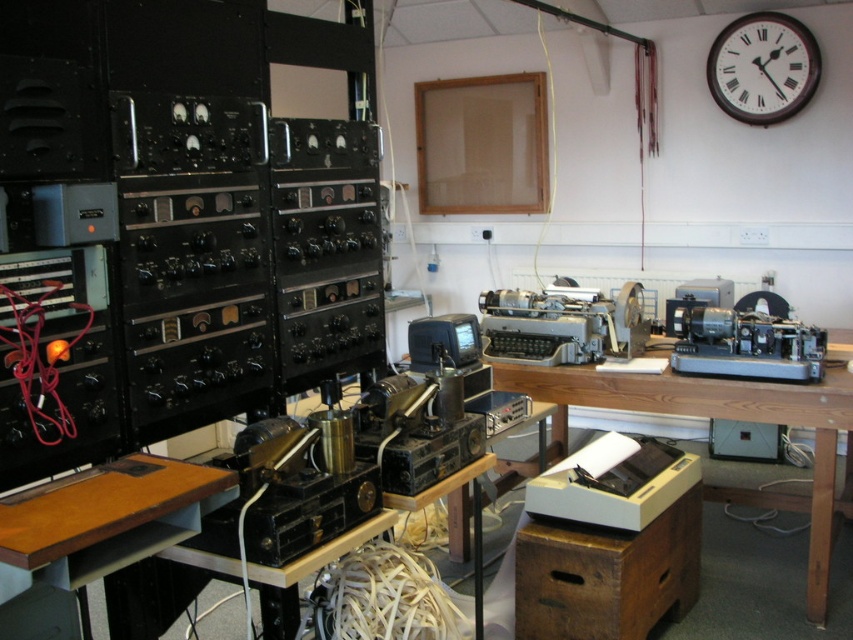
Question: Which object appears farthest from the camera in this image?

Choices:
 (A) metallic gray typewriter at center
 (B) wooden table at center
 (C) brown wooden clock at upper right

Answer: (C)

Question: Is wooden table at center to the left of brown wooden clock at upper right from the viewer's perspective?

Choices:
 (A) yes
 (B) no

Answer: (A)

Question: Which point appears farthest from the camera in this image?

Choices:
 (A) (576, 337)
 (B) (776, 99)

Answer: (B)

Question: Considering the relative positions of wooden table at center and metallic gray typewriter at center in the image provided, where is wooden table at center located with respect to metallic gray typewriter at center?

Choices:
 (A) right
 (B) left

Answer: (A)

Question: Is wooden table at center wider than brown wooden clock at upper right?

Choices:
 (A) no
 (B) yes

Answer: (B)

Question: Which object is closer to the camera taking this photo?

Choices:
 (A) wooden table at center
 (B) brown wooden clock at upper right
 (C) metallic gray typewriter at center

Answer: (A)